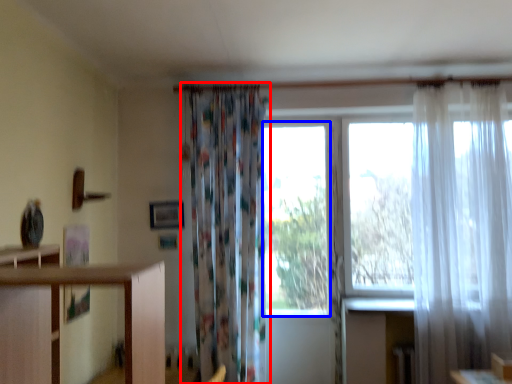
Question: Which point is closer to the camera, curtain (highlighted by a red box) or window (highlighted by a blue box)?

Choices:
 (A) curtain
 (B) window

Answer: (A)